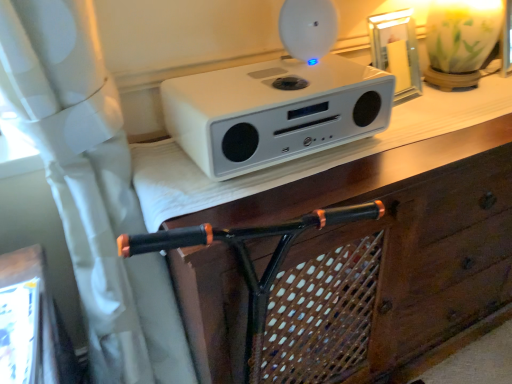
Question: Looking at the image, does white matte speaker at upper center seem bigger or smaller compared to white matte speaker at upper center?

Choices:
 (A) big
 (B) small

Answer: (A)

Question: Is point (138, 175) positioned closer to the camera than point (268, 140)?

Choices:
 (A) farther
 (B) closer

Answer: (A)

Question: From a real-world perspective, is white matte speaker at upper center positioned above or below white matte speaker at upper center?

Choices:
 (A) above
 (B) below

Answer: (B)

Question: Is white matte speaker at upper center inside the boundaries of white matte speaker at upper center, or outside?

Choices:
 (A) inside
 (B) outside

Answer: (B)

Question: From the image's perspective, is white matte speaker at upper center above or below white matte speaker at upper center?

Choices:
 (A) above
 (B) below

Answer: (A)

Question: Looking at their shapes, would you say white matte speaker at upper center is wider or thinner than white matte speaker at upper center?

Choices:
 (A) thin
 (B) wide

Answer: (A)

Question: Considering the positions of point (181, 144) and point (240, 195), is point (181, 144) closer or farther from the camera than point (240, 195)?

Choices:
 (A) farther
 (B) closer

Answer: (A)